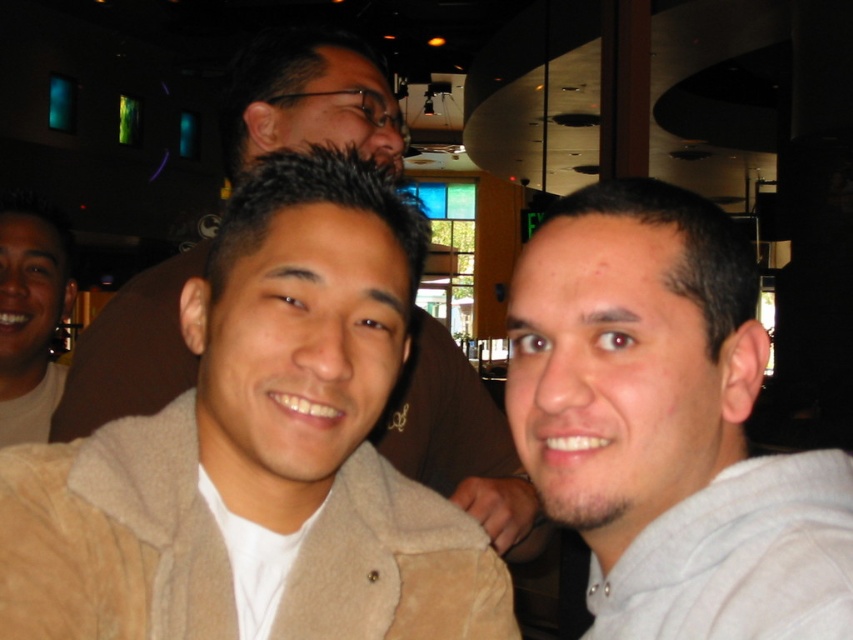
You are a photographer trying to capture a candid shot of the beige suede jacket at center without including the gray hoodie at right in the frame. Is this possible given their positions?

The gray hoodie at right is in front of the beige suede jacket at center, so it would block the view. Therefore, you cannot capture the beige suede jacket at center without including the gray hoodie at right in the frame.